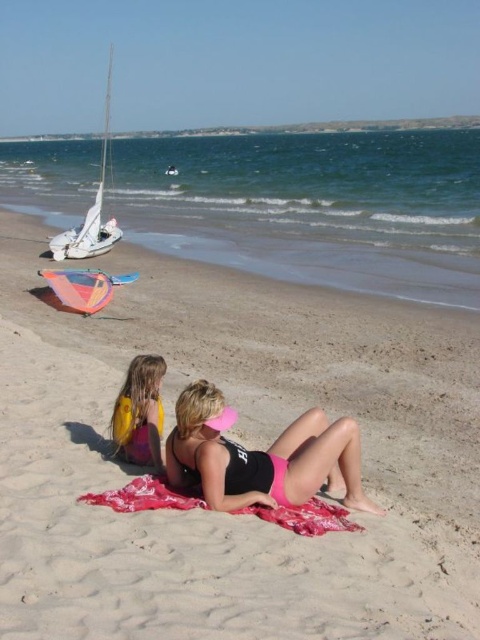
Question: Which point is closer to the camera taking this photo?

Choices:
 (A) (153, 460)
 (B) (98, 216)
 (C) (310, 509)

Answer: (C)

Question: Is pink matte swimsuit at center further to camera compared to red woven towel at center?

Choices:
 (A) no
 (B) yes

Answer: (B)

Question: Which of the following is the closest to the observer?

Choices:
 (A) (155, 388)
 (B) (175, 500)

Answer: (B)

Question: Does sandy beach at center have a greater width compared to white sailboat at left?

Choices:
 (A) yes
 (B) no

Answer: (B)

Question: In this image, where is sandy beach at center located relative to pink matte swimsuit at center?

Choices:
 (A) below
 (B) above

Answer: (B)

Question: Which point is farther to the camera?

Choices:
 (A) (264, 474)
 (B) (388, 513)

Answer: (B)